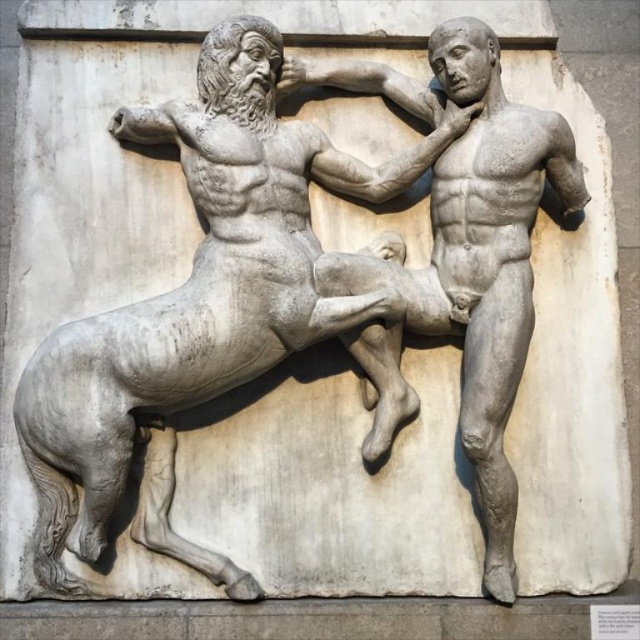
Question: From the image, what is the correct spatial relationship of white marble horse at center in relation to smooth stone man at center?

Choices:
 (A) below
 (B) above

Answer: (A)

Question: Which of the following is the farthest from the observer?

Choices:
 (A) (436, 186)
 (B) (218, 241)

Answer: (A)

Question: Is white marble horse at center positioned in front of smooth stone man at center?

Choices:
 (A) no
 (B) yes

Answer: (B)

Question: Does white marble horse at center have a greater width compared to smooth stone man at center?

Choices:
 (A) yes
 (B) no

Answer: (A)

Question: Which of the following is the closest to the observer?

Choices:
 (A) smooth stone man at center
 (B) white marble horse at center

Answer: (B)